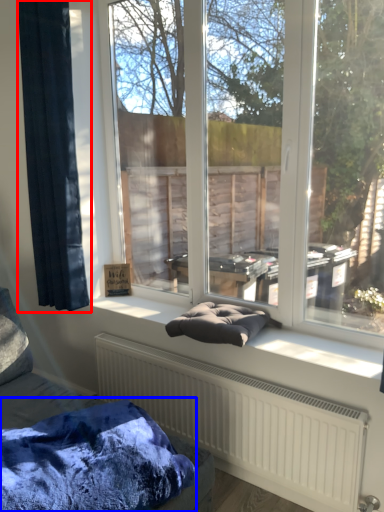
Question: Which object is further to the camera taking this photo, curtain (highlighted by a red box) or blanket (highlighted by a blue box)?

Choices:
 (A) curtain
 (B) blanket

Answer: (A)